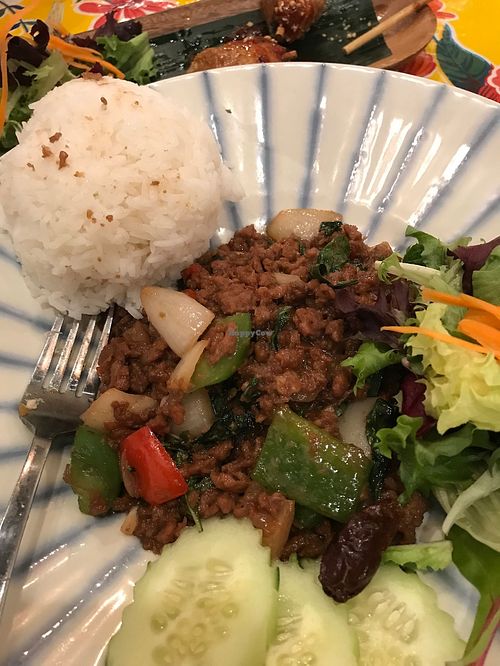
Where is `tablecloth`? This screenshot has width=500, height=666. tablecloth is located at coordinates (471, 35).